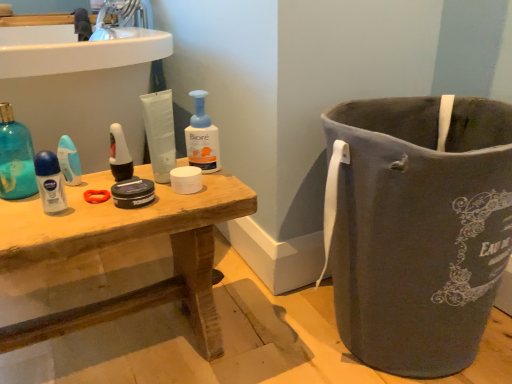
Image resolution: width=512 pixels, height=384 pixels. I want to click on free space to the back side of matte white shaving cream at left, so click(96, 181).